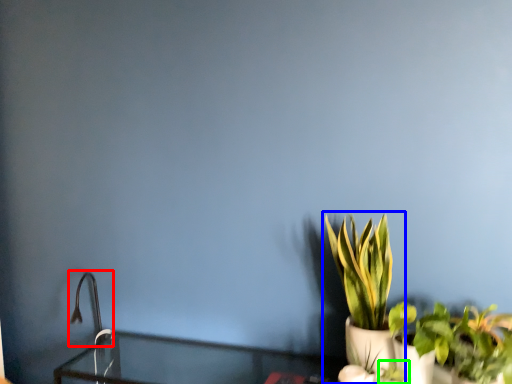
Question: Which is farther away from faucet (highlighted by a red box)? houseplant (highlighted by a blue box) or plant (highlighted by a green box)?

Choices:
 (A) houseplant
 (B) plant

Answer: (B)